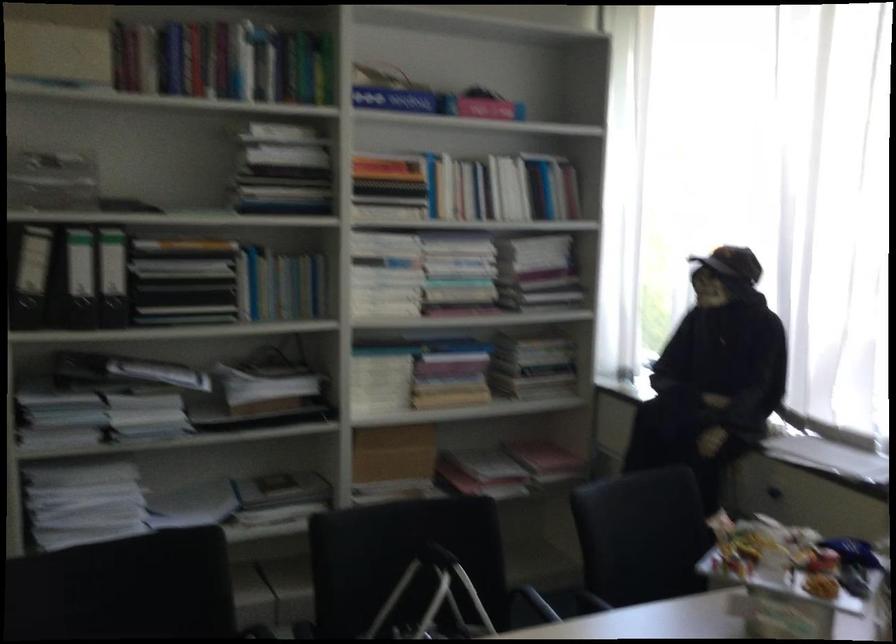
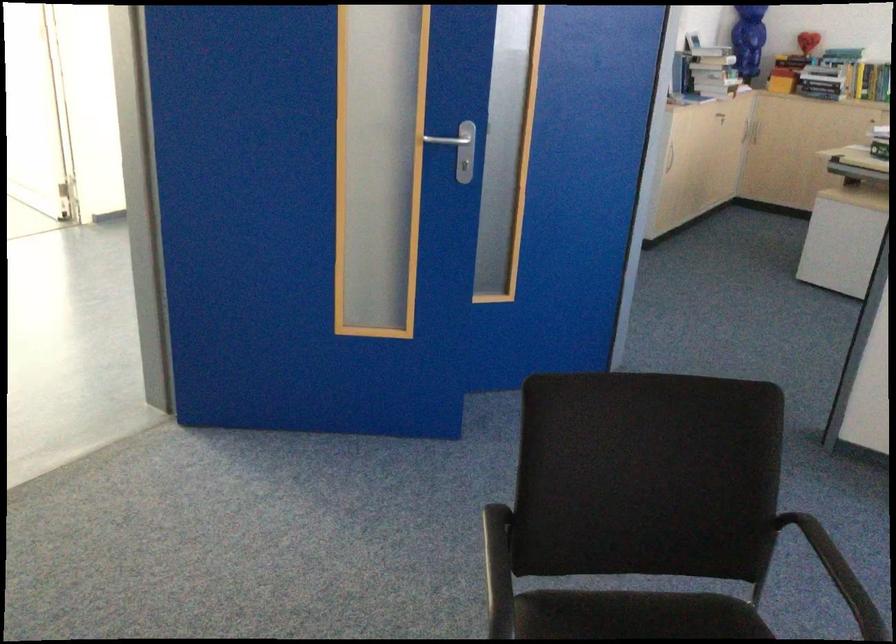
How did the camera likely rotate?

The camera rotated toward left-down.